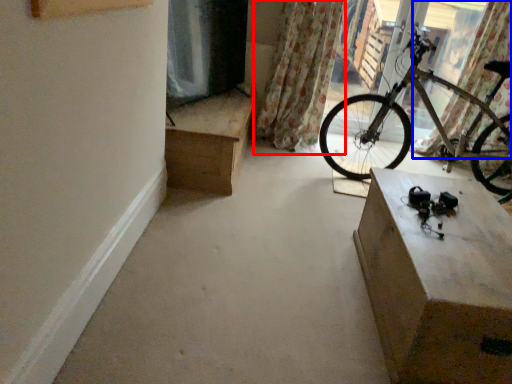
Question: Among these objects, which one is nearest to the camera, curtain (highlighted by a red box) or curtain (highlighted by a blue box)?

Choices:
 (A) curtain
 (B) curtain

Answer: (B)